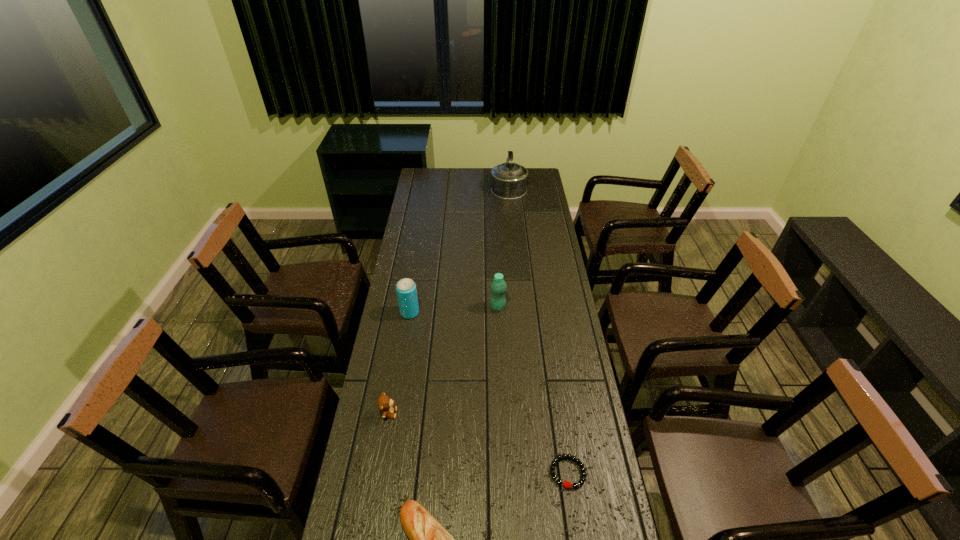
Find the location of `kettle`. kettle is located at coordinates (508, 180).

The height and width of the screenshot is (540, 960). Find the location of `the farthest object`. the farthest object is located at coordinates (508, 180).

The image size is (960, 540). In order to click on water bottle in this screenshot , I will do `click(498, 286)`.

Image resolution: width=960 pixels, height=540 pixels. Find the location of `soda can`. soda can is located at coordinates (406, 290).

Locate an element on the screen. the fourth tallest object is located at coordinates (385, 404).

Find the location of a particular element. The width and height of the screenshot is (960, 540). the third nearest object is located at coordinates (385, 404).

Where is `the second nearest object`? the second nearest object is located at coordinates (566, 484).

Where is `the shortest object`? the shortest object is located at coordinates (566, 484).

This screenshot has width=960, height=540. Find the location of `free spot located 0.070m with the spout at the front of the tallest object`. free spot located 0.070m with the spout at the front of the tallest object is located at coordinates (507, 170).

The height and width of the screenshot is (540, 960). Find the location of `blank area located at the front cap of the water bottle`. blank area located at the front cap of the water bottle is located at coordinates (447, 307).